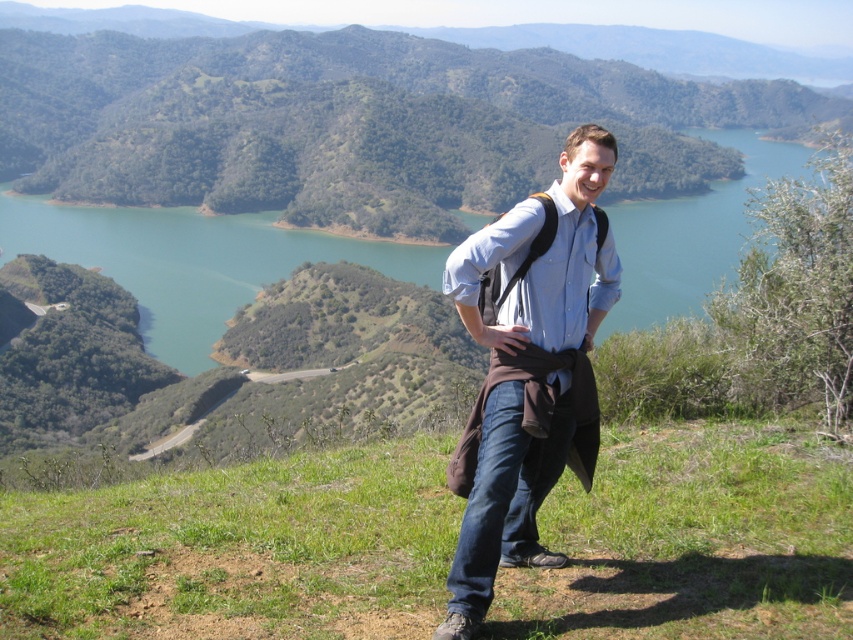
Question: Which point is farther to the camera?

Choices:
 (A) blue cotton shirt at center
 (B) green grassy hill at center

Answer: (B)

Question: Does green grassy hill at center appear on the left side of blue cotton shirt at center?

Choices:
 (A) no
 (B) yes

Answer: (A)

Question: Which point is closer to the camera?

Choices:
 (A) green grassy hill at center
 (B) blue cotton shirt at center

Answer: (B)

Question: Is green grassy hill at center bigger than blue cotton shirt at center?

Choices:
 (A) yes
 (B) no

Answer: (A)

Question: Is green grassy hill at center closer to camera compared to blue cotton shirt at center?

Choices:
 (A) no
 (B) yes

Answer: (A)